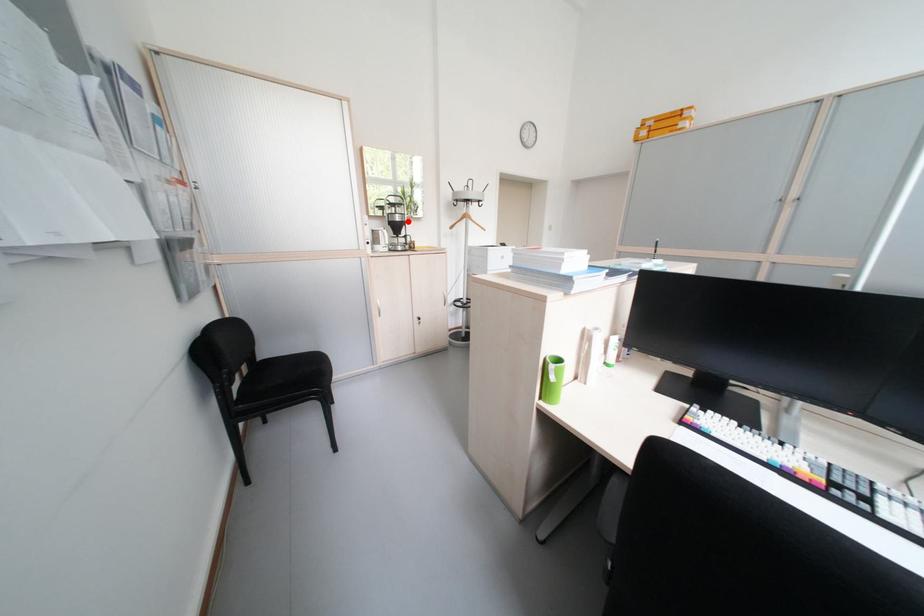
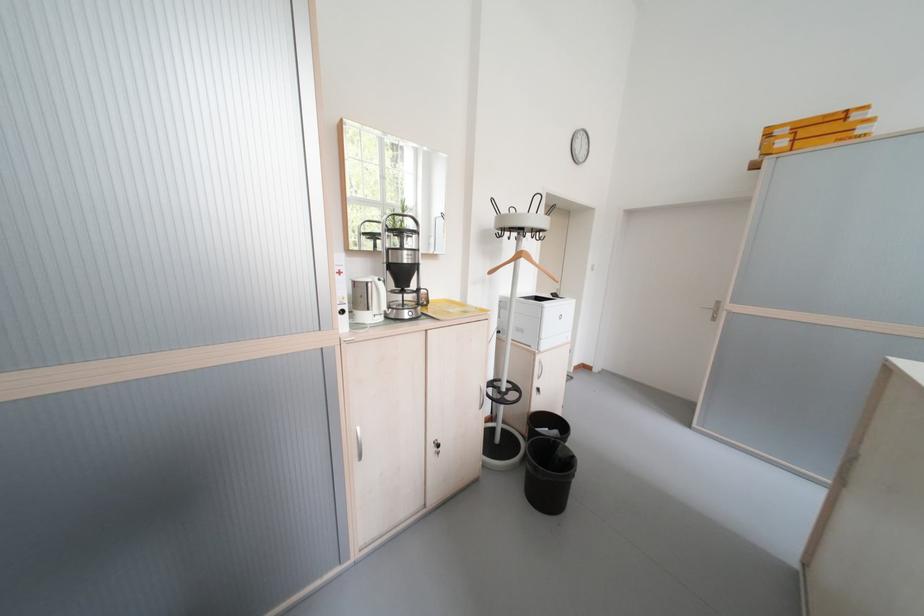
In the second image, find the point that corresponds to the highlighted location in the first image.

(416, 262)